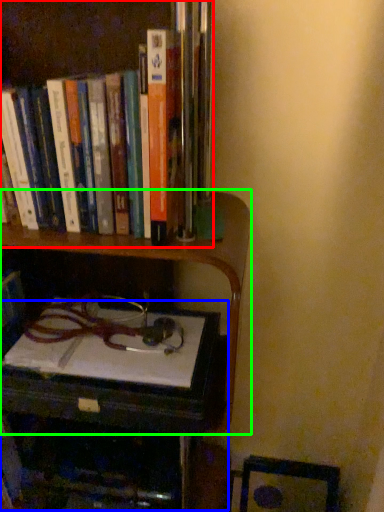
Question: Which is nearer to the book (highlighted by a red box)? table (highlighted by a blue box) or shelf (highlighted by a green box).

Choices:
 (A) table
 (B) shelf

Answer: (B)